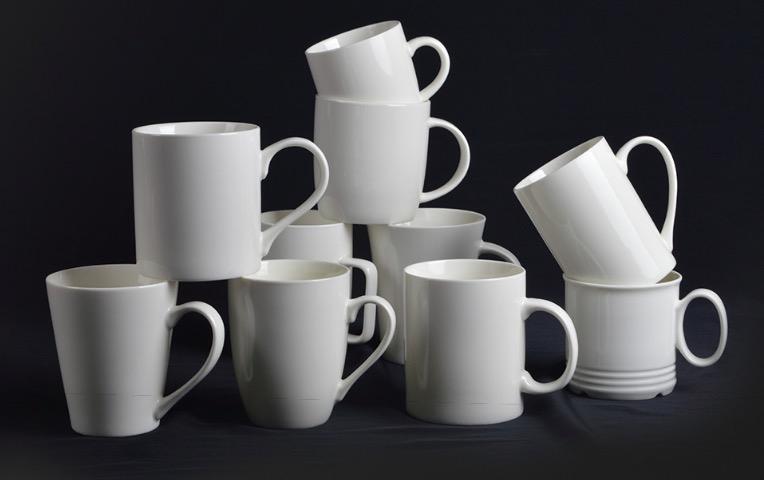
Where is `cups`? This screenshot has height=480, width=764. cups is located at coordinates (648, 343), (610, 238), (452, 242), (484, 326), (305, 333), (315, 245), (374, 163), (384, 79), (206, 192), (118, 344).